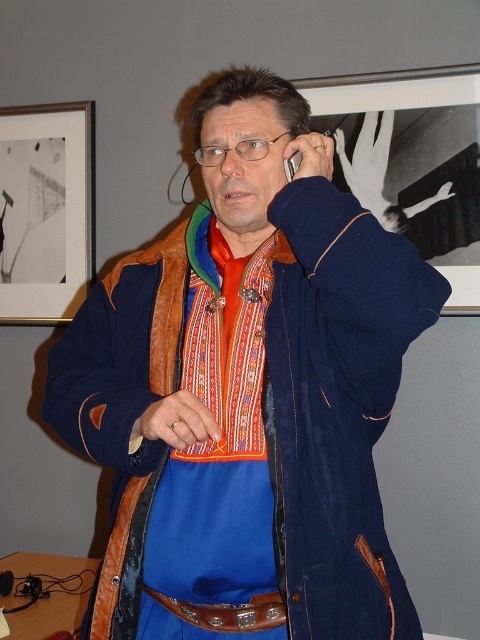
You are a tailor who needs to choose between an embroidered fabric apron at center and a brown leather belt at center to display in a narrow showcase. Which item would you choose and why?

The embroidered fabric apron at center has a larger width than the brown leather belt at center, so it would be more suitable for display in a narrow showcase as it occupies more space.